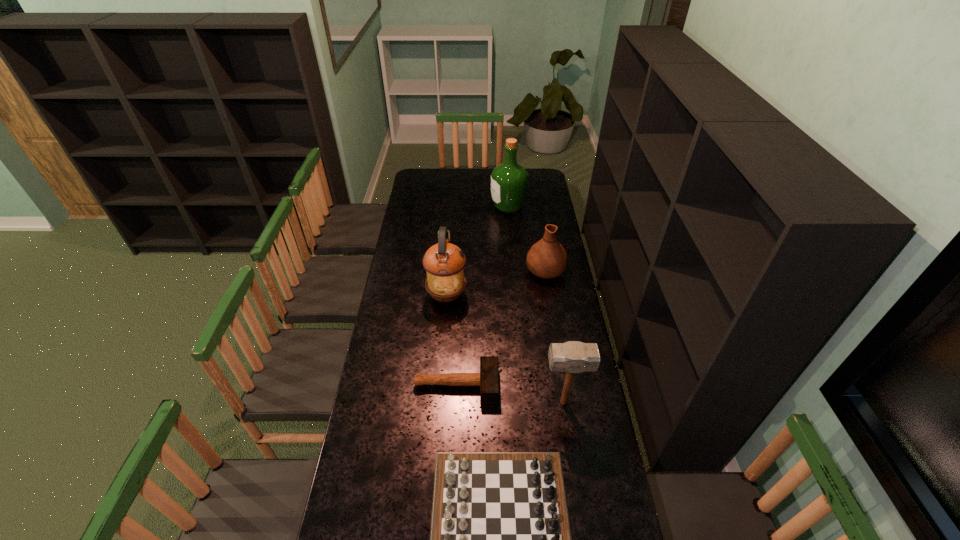
You are a GUI agent. You are given a task and a screenshot of the screen. Output one action in this format:
    pyautogui.click(x=<x>, y=<y>)
    Task: Click on the free point located 0.370m on the striking face of the taller mallet
    This screenshot has width=960, height=540.
    Given the screenshot: What is the action you would take?
    pyautogui.click(x=442, y=402)

Locate an element on the screen. The height and width of the screenshot is (540, 960). vacant region located 0.260m on the striking face of the taller mallet is located at coordinates (471, 402).

Find the location of a particular element. This screenshot has height=540, width=960. free space located 0.090m on the striking face of the taller mallet is located at coordinates (517, 402).

At what (x,y) coordinates should I click in order to perform the action: click on free space located 0.260m on the side of the third shortest object with the handle. Please return your answer as a coordinate pair (x, y). Looking at the image, I should click on (539, 225).

The width and height of the screenshot is (960, 540). I want to click on vacant space located 0.180m on the side of the third shortest object with the handle, so click(x=540, y=234).

At what (x,y) coordinates should I click in order to perform the action: click on blank area located on the side of the third shortest object with the handle. Please return your answer as a coordinate pair (x, y). This screenshot has height=540, width=960. Looking at the image, I should click on (538, 219).

In order to click on free space located 0.190m on the hammer head face of the shortest object in this screenshot , I will do `click(548, 385)`.

The height and width of the screenshot is (540, 960). Identify the location of mallet that is at the right edge. (571, 357).

Identify the location of pitcher located at the right edge. Image resolution: width=960 pixels, height=540 pixels. (547, 259).

The width and height of the screenshot is (960, 540). I want to click on vacant space at the far edge of the desktop, so click(455, 185).